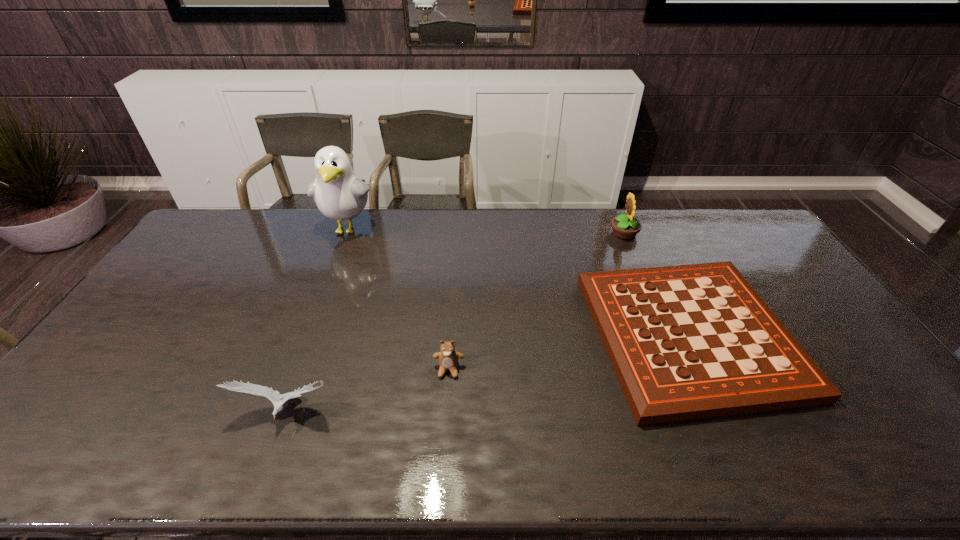
This screenshot has width=960, height=540. What are the coordinates of `the closest object relative to the taller gull` in the screenshot? It's located at (448, 358).

Identify the location of object identified as the fourth closest to the sunflower. (274, 396).

Identify the location of blank area in the image that satisfies the following two spatial constraints: 1. on the back side of the gameboard; 2. on the face of the second tallest object. (642, 233).

Locate an element on the screen. This screenshot has height=540, width=960. vacant space that satisfies the following two spatial constraints: 1. on the face of the sunflower; 2. on the left side of the gameboard is located at coordinates (665, 335).

Locate an element on the screen. Image resolution: width=960 pixels, height=540 pixels. free space that satisfies the following two spatial constraints: 1. on the face of the second tallest object; 2. on the left side of the gameboard is located at coordinates (665, 335).

Find the location of a particular element. The image size is (960, 540). free location that satisfies the following two spatial constraints: 1. on the beak of the farther gull; 2. on the right side of the gameboard is located at coordinates (309, 335).